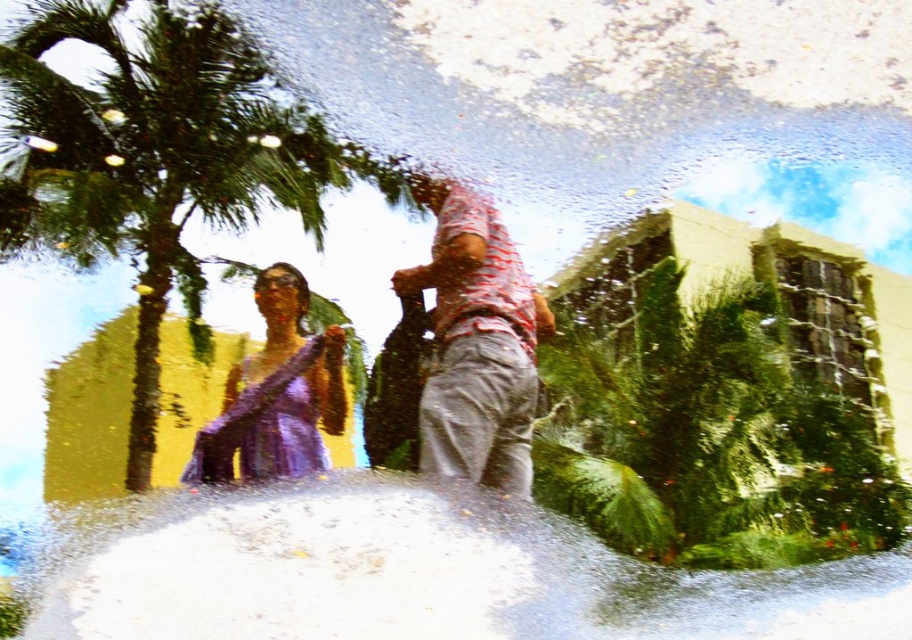
Between green leafy palm tree at upper left and purple satin dress at left, which one has more height?

green leafy palm tree at upper left is taller.

Does green leafy palm tree at upper left have a lesser width compared to purple satin dress at left?

Incorrect, green leafy palm tree at upper left's width is not less than purple satin dress at left's.

Locate an element on the screen. The height and width of the screenshot is (640, 912). green leafy palm tree at upper left is located at coordinates (151, 156).

Is striped cotton shirt at center in front of purple satin dress at left?

No, striped cotton shirt at center is further to the viewer.

Consider the image. Who is more forward, (444, 358) or (319, 412)?

Positioned in front is point (319, 412).

Locate an element on the screen. The image size is (912, 640). striped cotton shirt at center is located at coordinates (475, 342).

Which is more to the left, green leafy palm tree at upper left or striped cotton shirt at center?

green leafy palm tree at upper left is more to the left.

Which is above, green leafy palm tree at upper left or striped cotton shirt at center?

Positioned higher is green leafy palm tree at upper left.

Image resolution: width=912 pixels, height=640 pixels. Identify the location of green leafy palm tree at upper left. click(151, 156).